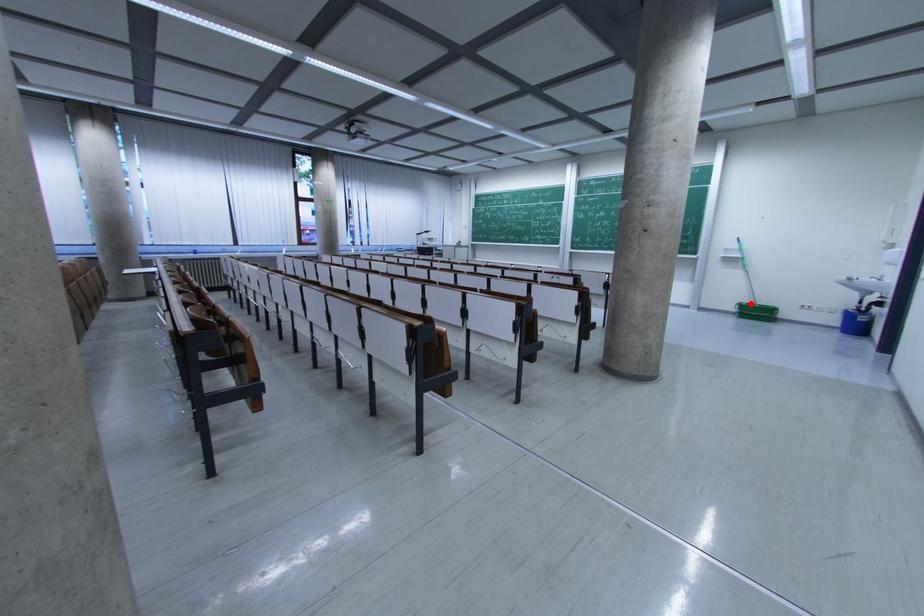
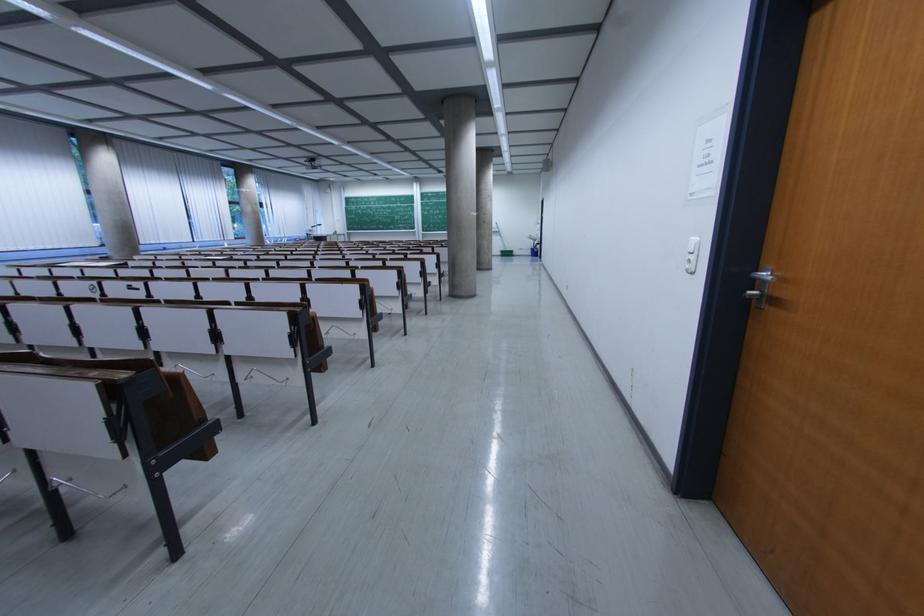
Question: I am providing you with two images of the same scene from different viewpoints. Given a red point in image1, look at the same physical point in image2. Is it:

Choices:
 (A) Closer to the viewpoint
 (B) Farther from the viewpoint

Answer: (A)